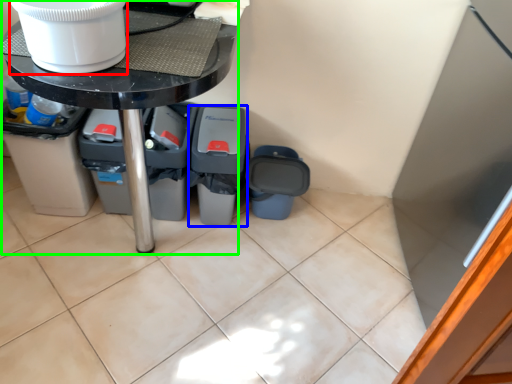
Question: Which object is the closest to the toilet bowl (highlighted by a red box)? Choose among these: recycling bin (highlighted by a blue box) or table (highlighted by a green box).

Choices:
 (A) recycling bin
 (B) table

Answer: (B)